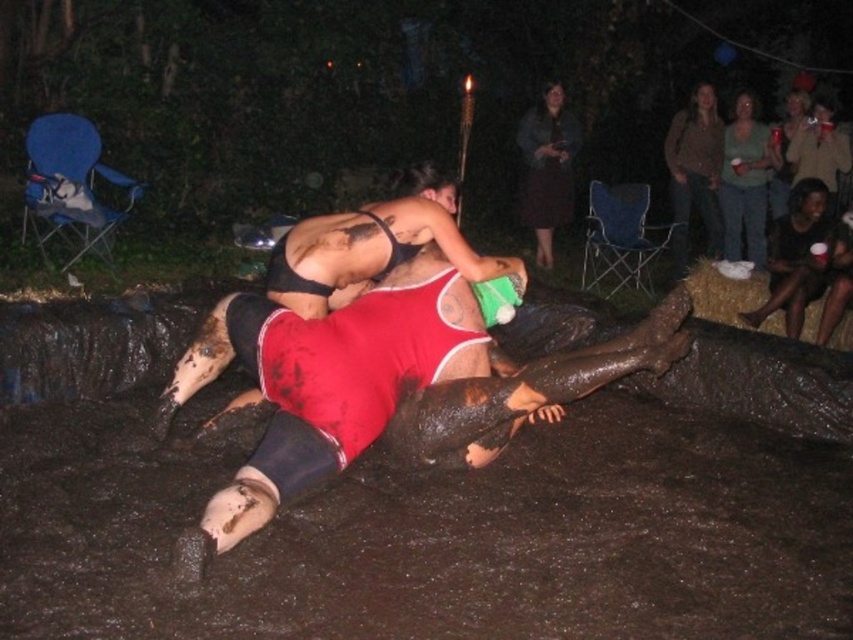
Question: Which object is positioned farthest from the dark skin textured legs at lower right?

Choices:
 (A) brown textured sweater at upper right
 (B) green matte shirt at upper right
 (C) black matte bikini top at center

Answer: (C)

Question: Which object is positioned closest to the dark brown fabric dress at upper center?

Choices:
 (A) black matte bikini top at center
 (B) green matte shirt at upper right
 (C) red fabric tank top at center
 (D) brown textured sweater at upper right

Answer: (D)

Question: Observing the image, what is the correct spatial positioning of red fabric tank top at center in reference to dark brown fabric dress at upper center?

Choices:
 (A) above
 (B) below

Answer: (B)

Question: Considering the relative positions of dark skin textured legs at lower right and dark brown fabric dress at upper center in the image provided, where is dark skin textured legs at lower right located with respect to dark brown fabric dress at upper center?

Choices:
 (A) right
 (B) left

Answer: (A)

Question: Does dark skin textured legs at lower right appear over dark brown fabric dress at upper center?

Choices:
 (A) yes
 (B) no

Answer: (B)

Question: Which object is closer to the camera taking this photo?

Choices:
 (A) brown textured sweater at upper right
 (B) dark skin textured legs at lower right
 (C) red fabric tank top at center

Answer: (C)